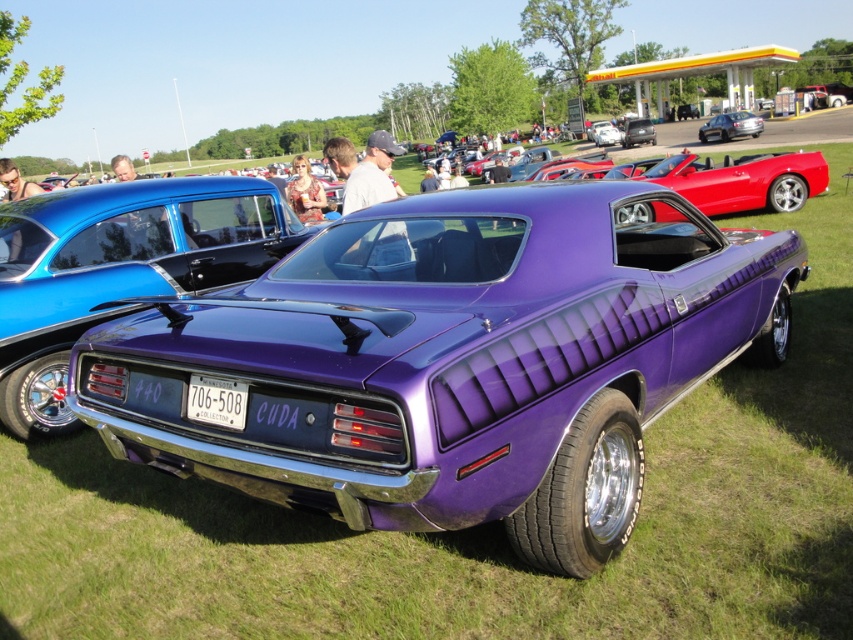
You are standing at the camera position and want to place a 10 feet long banner in front of the purple muscle car. The banner needs to be placed at the point with coordinates point (x=355, y=426). Is the distance from the camera to this point sufficient to accommodate the banner without it being too close or too far?

The distance of point (x=355, y=426) from camera is 7.59 feet, which is less than the required 10 feet for the banner. Therefore, placing the banner at this point would be too close.

You are a photographer at the car show and want to capture both the metallic blue sedan at center and the white plastic license plate at center in a single shot. Given that the camera can only focus on objects within a 30 cm range, will you be able to capture both clearly?

The metallic blue sedan at center is larger than the white plastic license plate at center, but since the camera can focus on objects within a 30 cm range, both can be captured clearly if they are within that distance from the camera.